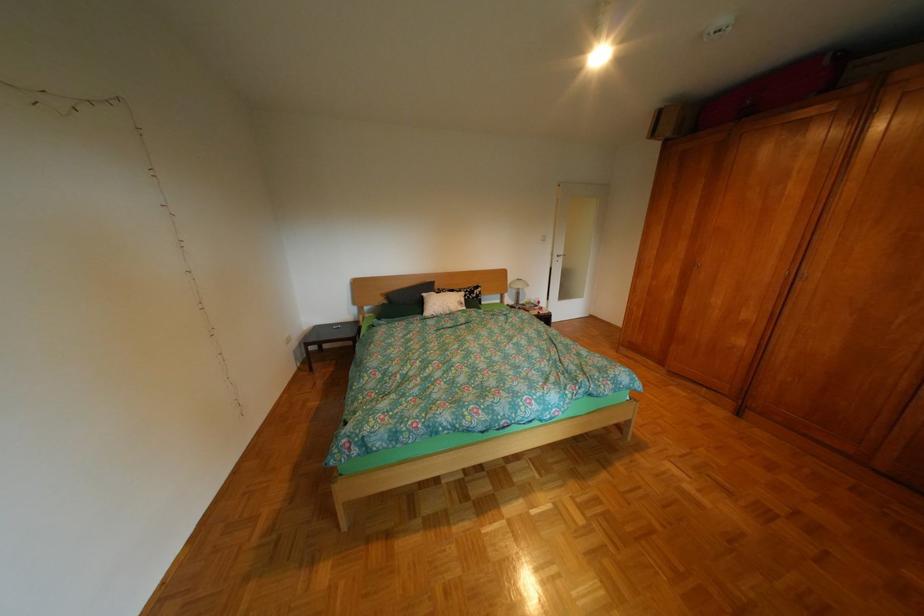
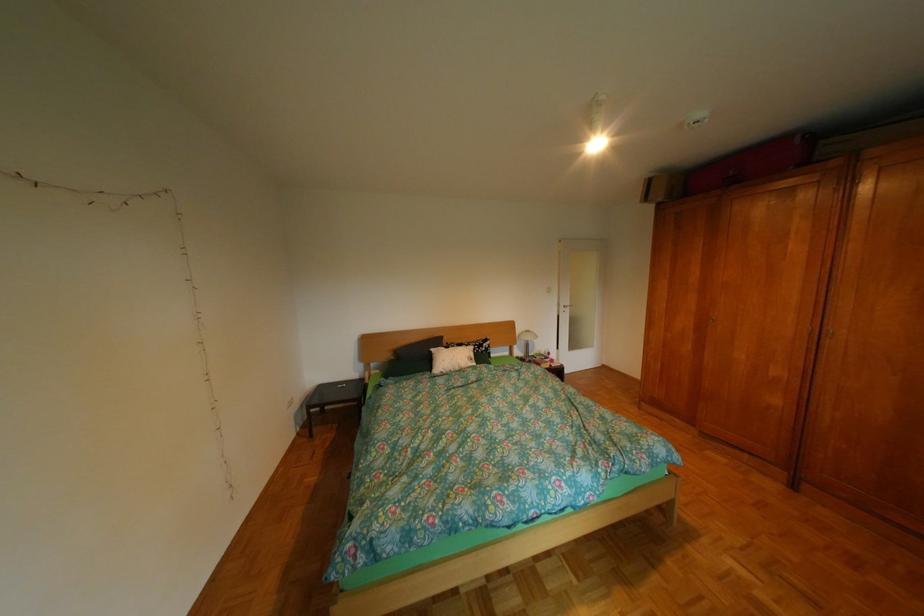
In the second image, find the point that corresponds to the point at 842,63 in the first image.

(812, 142)